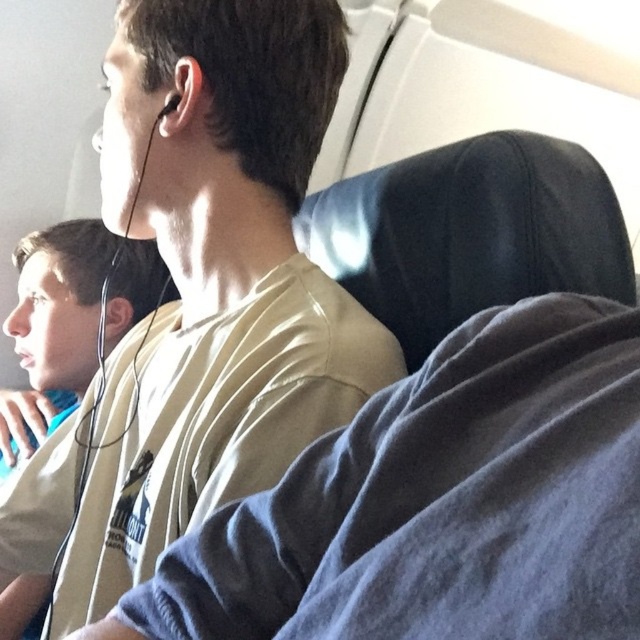
Between black leather seat at center and black matte earphone at upper left, which one has more height?

Answer: black leather seat at center is taller.

The width and height of the screenshot is (640, 640). Describe the element at coordinates (468, 232) in the screenshot. I see `black leather seat at center` at that location.

Which is in front, point (396, 205) or point (161, 120)?

Positioned in front is point (396, 205).

You are a GUI agent. You are given a task and a screenshot of the screen. Output one action in this format:
    pyautogui.click(x=<x>, y=<y>)
    Task: Click on the black leather seat at center
    This screenshot has height=640, width=640.
    Given the screenshot: What is the action you would take?
    pyautogui.click(x=468, y=232)

Is light beige t-shirt at center behind black leather seat at center?

No, light beige t-shirt at center is in front of black leather seat at center.

Which is above, light beige t-shirt at center or black leather seat at center?

Positioned higher is black leather seat at center.

The width and height of the screenshot is (640, 640). What are the coordinates of `light beige t-shirt at center` in the screenshot? It's located at (218, 275).

Who is shorter, light beige t-shirt at center or black matte earphone at upper left?

With less height is black matte earphone at upper left.

Is the position of light beige t-shirt at center more distant than that of black matte earphone at upper left?

No, light beige t-shirt at center is in front of black matte earphone at upper left.

The width and height of the screenshot is (640, 640). What do you see at coordinates (218, 275) in the screenshot? I see `light beige t-shirt at center` at bounding box center [218, 275].

Where is `light beige t-shirt at center`? The width and height of the screenshot is (640, 640). light beige t-shirt at center is located at coordinates (218, 275).